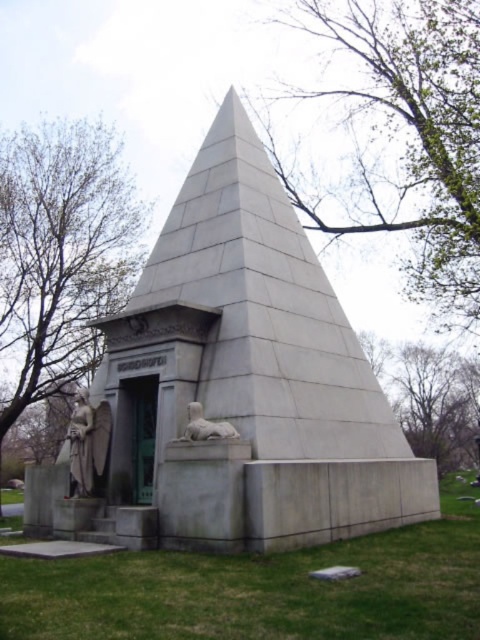
Question: Does gray stone pyramid at center appear under gray stone lion at lower center?

Choices:
 (A) no
 (B) yes

Answer: (A)

Question: Which point appears farthest from the camera in this image?

Choices:
 (A) (196, 417)
 (B) (98, 404)
 (C) (397, 180)

Answer: (C)

Question: Can you confirm if gray stone pyramid at center is thinner than green leafy tree at upper center?

Choices:
 (A) yes
 (B) no

Answer: (A)

Question: Which object is the farthest from the white marble statue at lower left?

Choices:
 (A) gray stone lion at lower center
 (B) green leafy tree at upper center
 (C) gray stone pyramid at center

Answer: (B)

Question: Which point is closer to the camera taking this photo?

Choices:
 (A) (79, 244)
 (B) (93, 474)

Answer: (B)

Question: Is white marble statue at lower left positioned in front of gray stone lion at lower center?

Choices:
 (A) yes
 (B) no

Answer: (B)